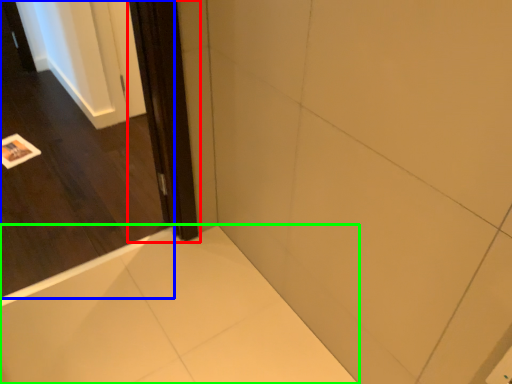
Question: Which is farther away from screen door (highlighted by a red box)? door (highlighted by a blue box) or bath (highlighted by a green box)?

Choices:
 (A) door
 (B) bath

Answer: (A)